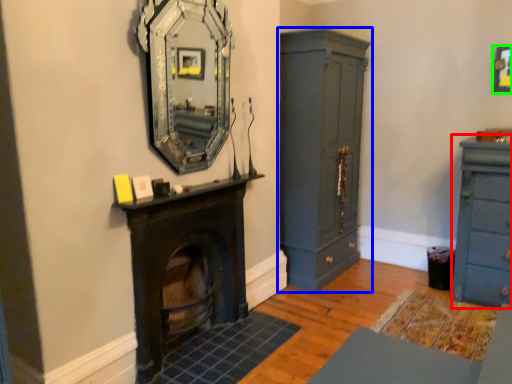
Question: Which is farther away from chest of drawers (highlighted by a red box)? cupboard (highlighted by a blue box) or picture frame (highlighted by a green box)?

Choices:
 (A) cupboard
 (B) picture frame

Answer: (A)